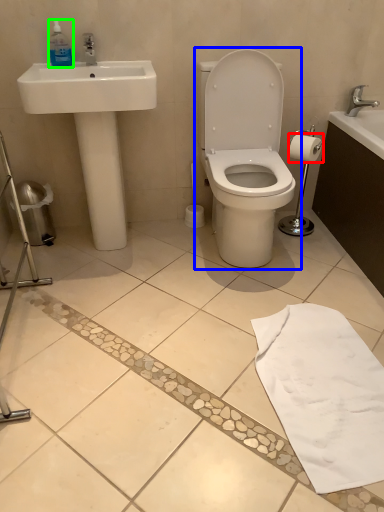
Question: Which object is the closest to the toilet paper (highlighted by a red box)? Choose among these: toilet (highlighted by a blue box) or bottle (highlighted by a green box).

Choices:
 (A) toilet
 (B) bottle

Answer: (A)